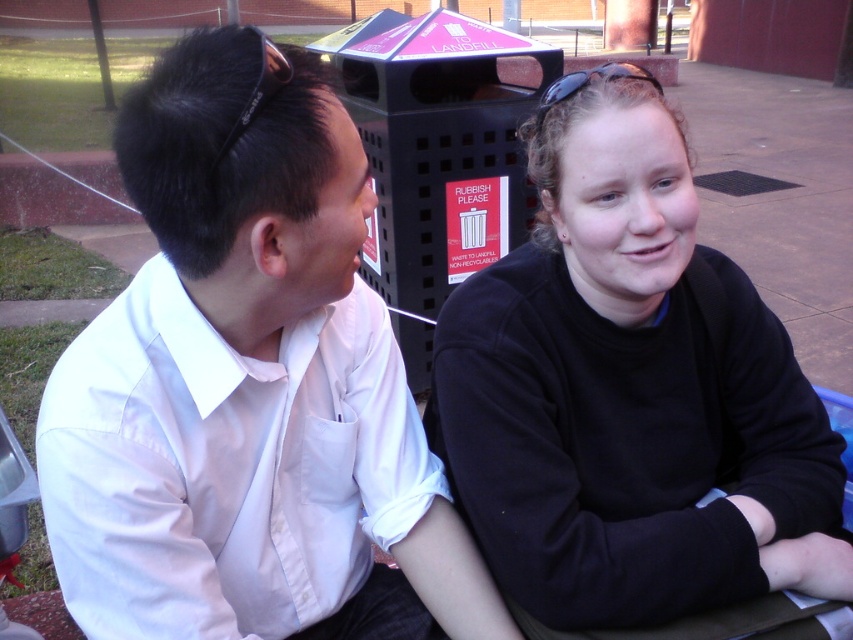
You are a delivery robot positioned at point (473, 394). The trash bin labeled RUBBISH PLEASE is located in the scene. Can you estimate how far you are from the trash bin?

The distance between point (473, 394) and the camera is 1.10 meters. Since the camera is capturing the scene, the trash bin is within this distance. However, the exact distance to the trash bin cannot be determined without additional information about its position relative to the point.

You are a fashion designer observing the scene. You notice the black matte sweater at center. Can you determine its exact location in the image using coordinates?

The black matte sweater at center is located at coordinates point [630,392].

From the picture: You are standing at the origin point in the image. The black matte sweater at center is located at point (x=630, y=392). Which direction should you move to reach the black matte sweater at center?

To reach the black matte sweater at center located at point (x=630, y=392), you should move towards the center of the image since the coordinates indicate it is positioned centrally.